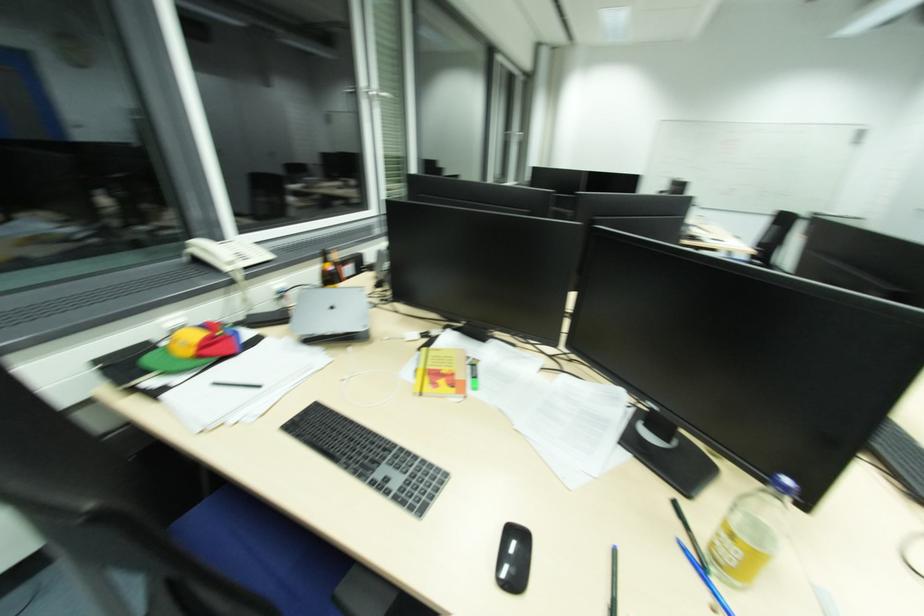
This screenshot has width=924, height=616. What do you see at coordinates (441, 373) in the screenshot? I see `the yellow book` at bounding box center [441, 373].